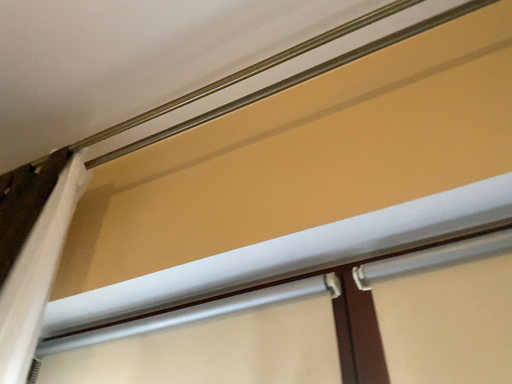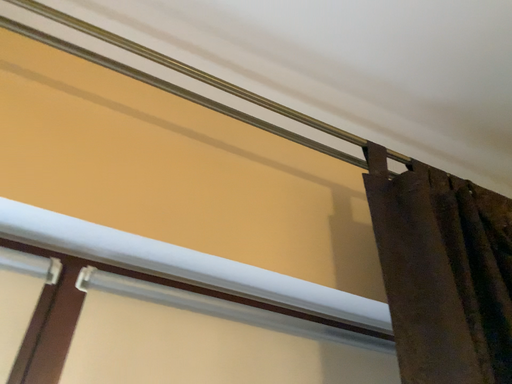
Question: How did the camera likely rotate when shooting the video?

Choices:
 (A) rotated left
 (B) rotated right

Answer: (B)